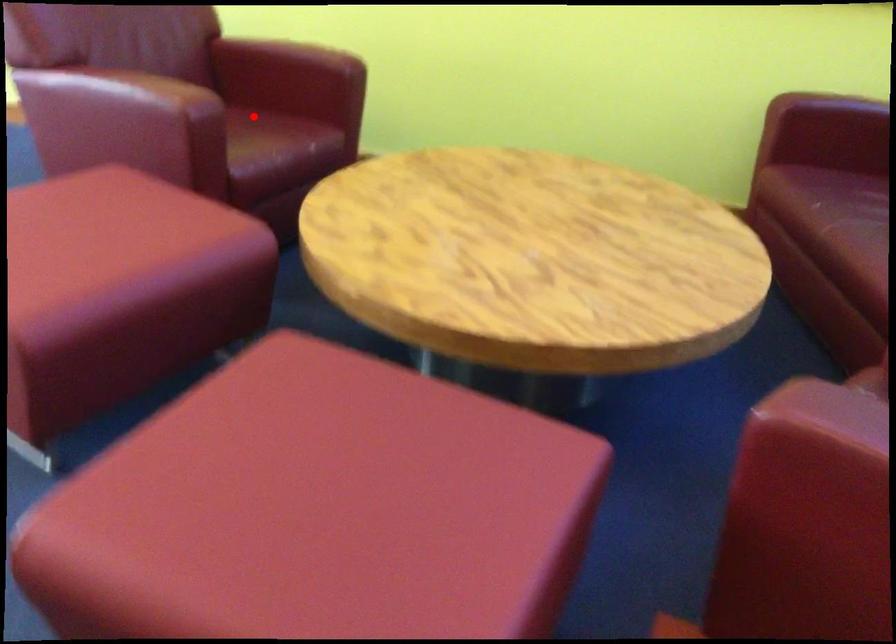
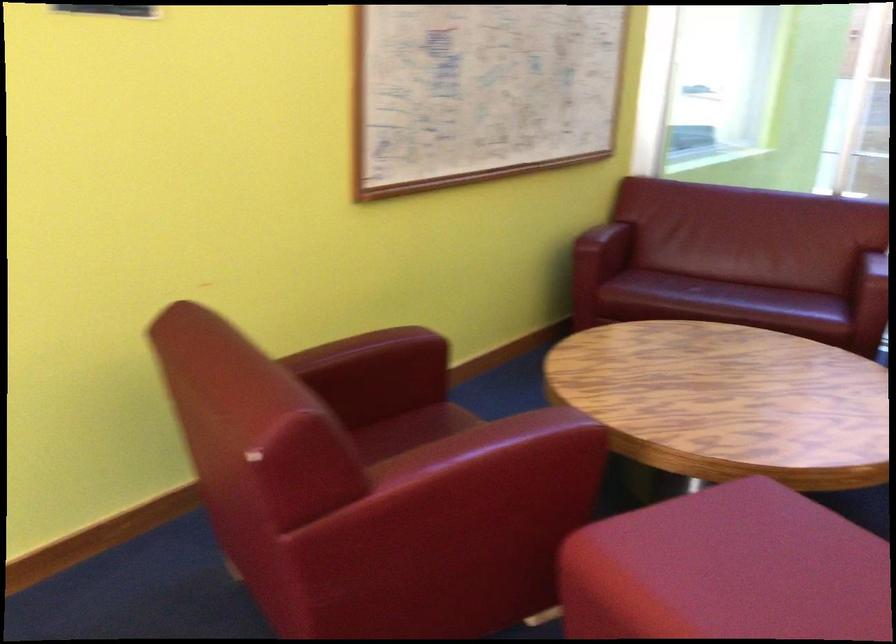
The point at the highlighted location is marked in the first image. Where is the corresponding point in the second image?

(410, 428)